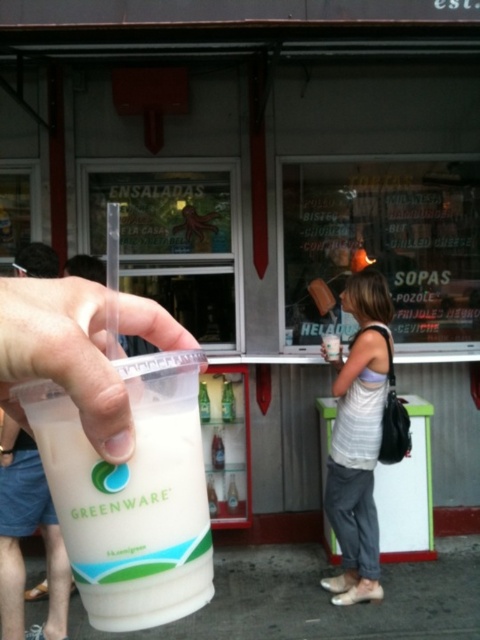
You are at a food stand and want to choose a cup for your drink. The vendor offers you both the white matte cup at center and the translucent plastic cup at center. Which cup should you choose if you want the one that can hold more liquid?

The white matte cup at center is larger in size than the translucent plastic cup at center, so it can hold more liquid.

You are a delivery person who needs to place the white matte cup at center into a box that can only accommodate items up to 55 centimeters in length. Can the cup fit?

The white matte cup at center is 55.25 centimeters in length, which exceeds the box limit of 55 centimeters. Therefore, the cup cannot fit into the box.